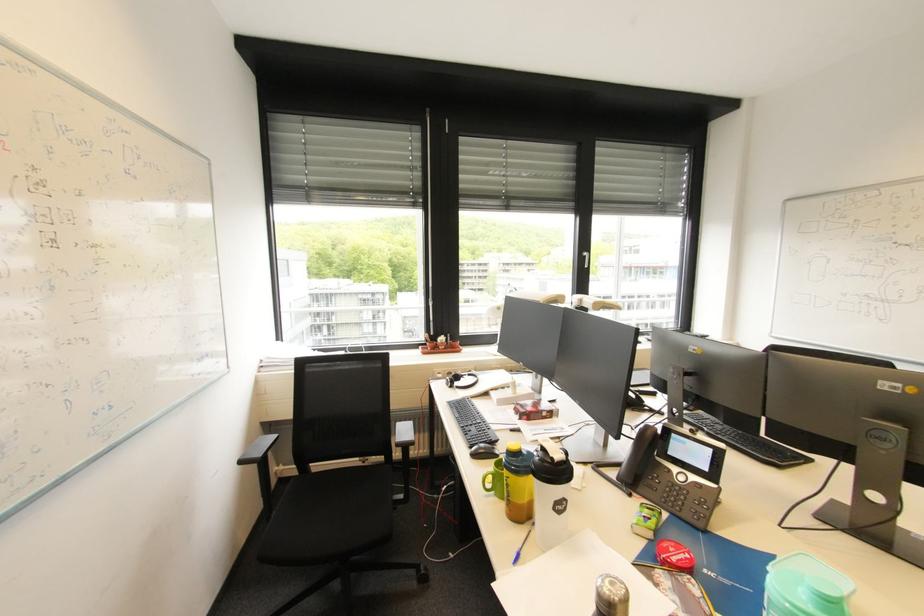
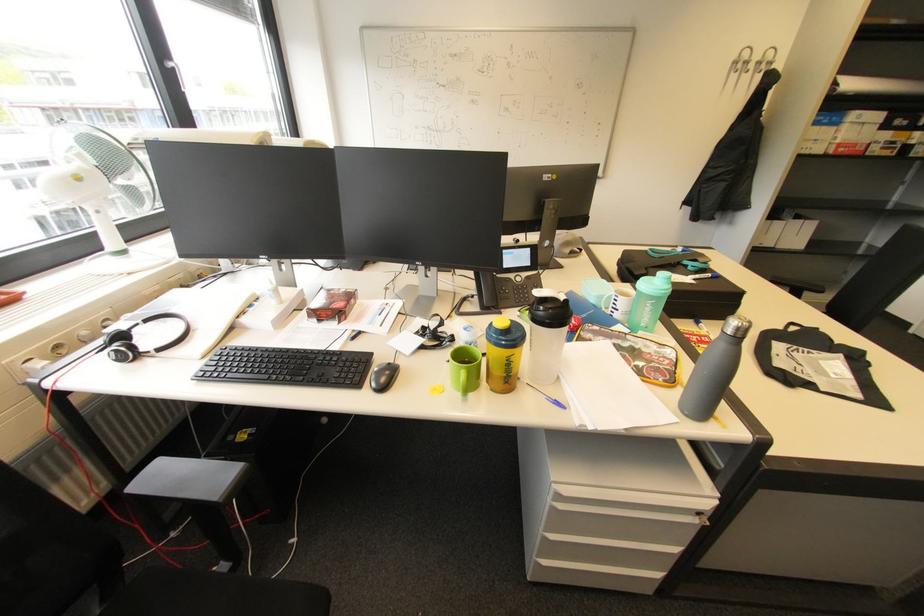
The point at (453, 386) is marked in the first image. Where is the corresponding point in the second image?

(127, 361)